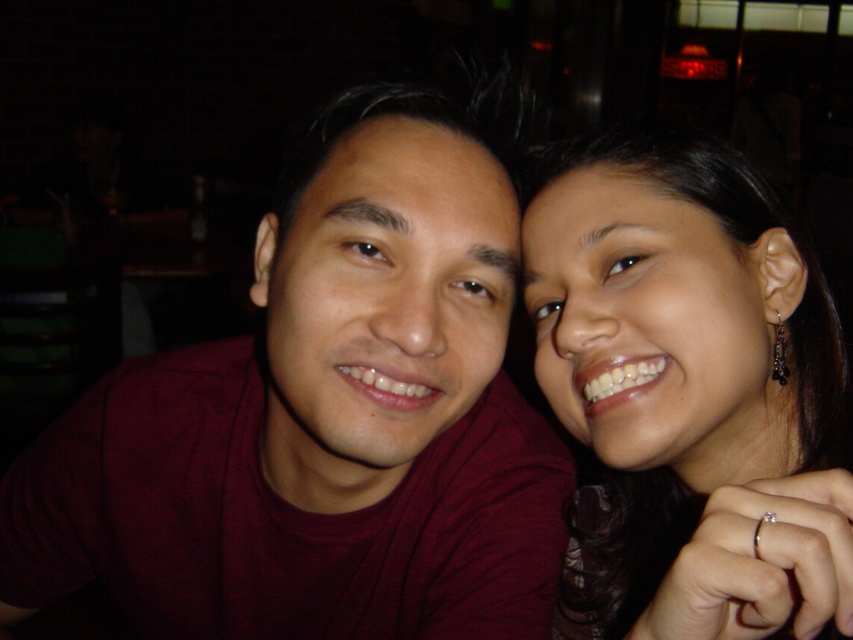
Does maroon t-shirt at center have a greater height compared to smooth skin face at right?

Correct, maroon t-shirt at center is much taller as smooth skin face at right.

Which of these two, maroon t-shirt at center or smooth skin face at right, stands shorter?

Standing shorter between the two is smooth skin face at right.

The image size is (853, 640). Describe the element at coordinates (322, 420) in the screenshot. I see `maroon t-shirt at center` at that location.

Locate an element on the screen. This screenshot has height=640, width=853. maroon t-shirt at center is located at coordinates (x=322, y=420).